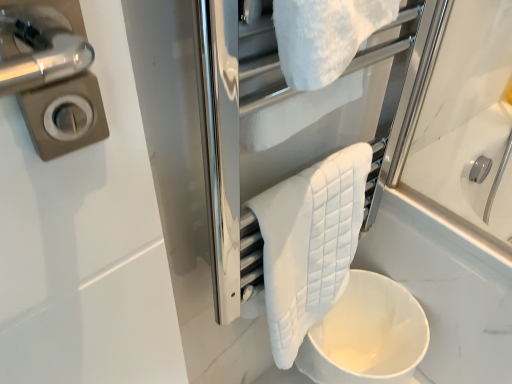
Question: Does white quilted towel at upper center have a greater height compared to white quilted towel at center?

Choices:
 (A) no
 (B) yes

Answer: (A)

Question: Is white quilted towel at upper center facing towards white quilted towel at center?

Choices:
 (A) no
 (B) yes

Answer: (A)

Question: From a real-world perspective, is white quilted towel at upper center below white quilted towel at center?

Choices:
 (A) no
 (B) yes

Answer: (A)

Question: Considering the relative sizes of white quilted towel at upper center and white quilted towel at center in the image provided, is white quilted towel at upper center smaller than white quilted towel at center?

Choices:
 (A) yes
 (B) no

Answer: (A)

Question: Can you confirm if white quilted towel at upper center is shorter than white quilted towel at center?

Choices:
 (A) yes
 (B) no

Answer: (A)

Question: Considering the relative sizes of white quilted towel at upper center and white quilted towel at center in the image provided, is white quilted towel at upper center thinner than white quilted towel at center?

Choices:
 (A) no
 (B) yes

Answer: (A)

Question: Is white matte toilet bowl at lower center to the left of white quilted towel at upper center from the viewer's perspective?

Choices:
 (A) no
 (B) yes

Answer: (A)

Question: Does white matte toilet bowl at lower center have a larger size compared to white quilted towel at upper center?

Choices:
 (A) yes
 (B) no

Answer: (A)

Question: Is white matte toilet bowl at lower center touching white quilted towel at upper center?

Choices:
 (A) no
 (B) yes

Answer: (A)

Question: Does white matte toilet bowl at lower center appear on the right side of white quilted towel at upper center?

Choices:
 (A) yes
 (B) no

Answer: (A)

Question: From a real-world perspective, is white matte toilet bowl at lower center physically above white quilted towel at upper center?

Choices:
 (A) no
 (B) yes

Answer: (A)

Question: Is white quilted towel at upper center surrounded by white matte toilet bowl at lower center?

Choices:
 (A) yes
 (B) no

Answer: (B)

Question: Does white quilted towel at upper center have a lesser height compared to white matte toilet bowl at lower center?

Choices:
 (A) yes
 (B) no

Answer: (A)